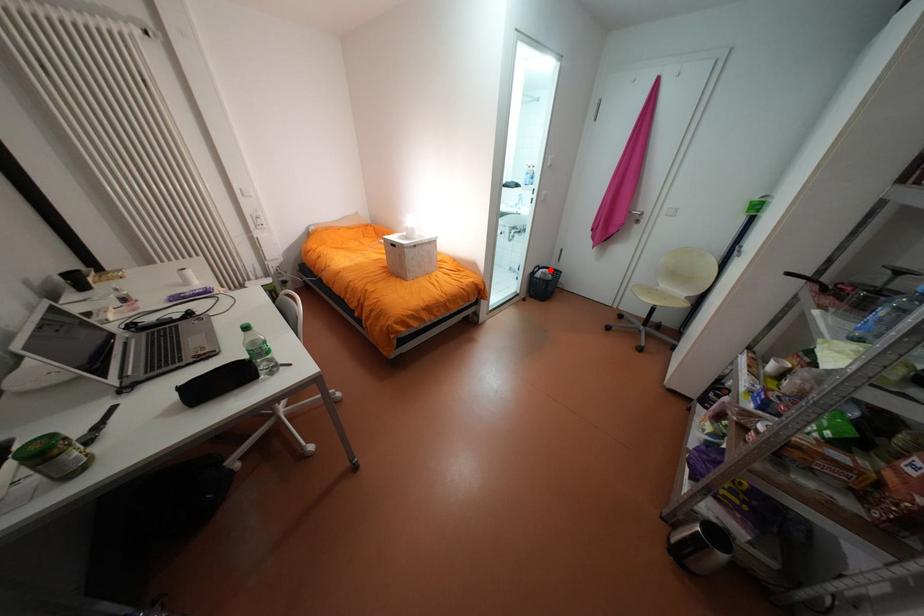
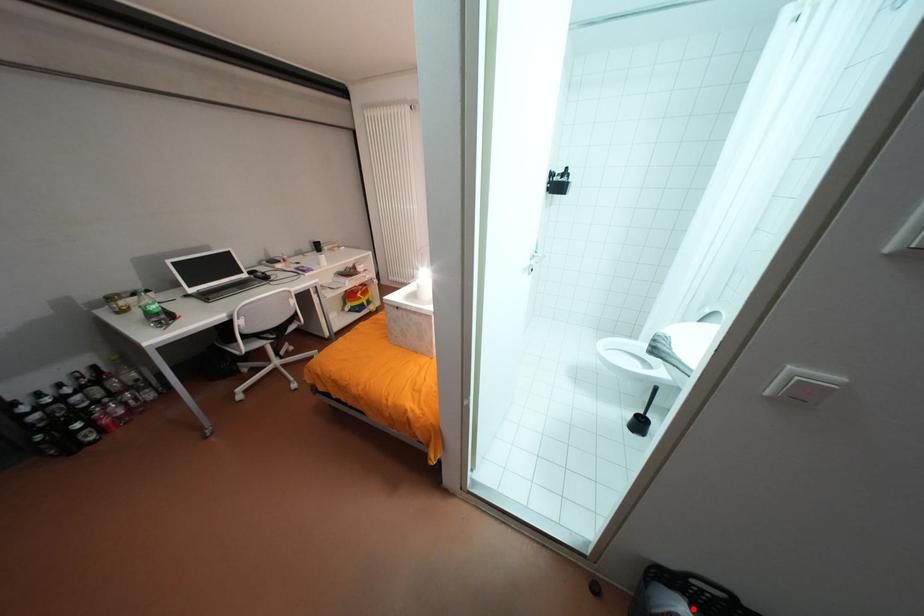
I am providing you with two images of the same scene from different viewpoints. A red point is marked on the first image and another point is marked on the second image. Is the marked point in image1 the same physical position as the marked point in image2?

Yes